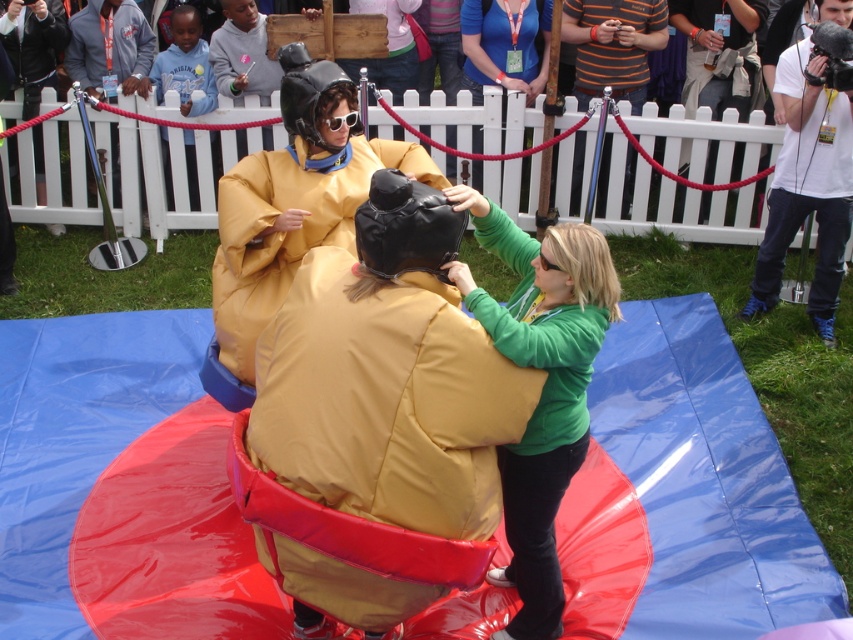
What do you see at coordinates (807, 186) in the screenshot?
I see `white cotton t-shirt at upper right` at bounding box center [807, 186].

Based on the photo, between white cotton t-shirt at upper right and striped cotton shirt at upper center, which one appears on the left side from the viewer's perspective?

Positioned to the left is striped cotton shirt at upper center.

Is point (817, 256) in front of point (577, 150)?

Yes, it is in front of point (577, 150).

I want to click on white cotton t-shirt at upper right, so click(807, 186).

Does matte yellow sumo at center lie in front of white cotton t-shirt at upper right?

Yes, matte yellow sumo at center is closer to the viewer.

Is matte yellow sumo at center further to camera compared to white cotton t-shirt at upper right?

No, matte yellow sumo at center is closer to the viewer.

Locate an element on the screen. The height and width of the screenshot is (640, 853). matte yellow sumo at center is located at coordinates (543, 387).

I want to click on matte yellow sumo at center, so click(x=543, y=387).

Is matte yellow sumo at center taller than gray fleece jacket at upper left?

Yes, matte yellow sumo at center is taller than gray fleece jacket at upper left.

Consider the image. How much distance is there between matte yellow sumo at center and gray fleece jacket at upper left?

matte yellow sumo at center and gray fleece jacket at upper left are 6.12 meters apart.

Describe the element at coordinates (543, 387) in the screenshot. I see `matte yellow sumo at center` at that location.

The width and height of the screenshot is (853, 640). What are the coordinates of `matte yellow sumo at center` in the screenshot? It's located at (543, 387).